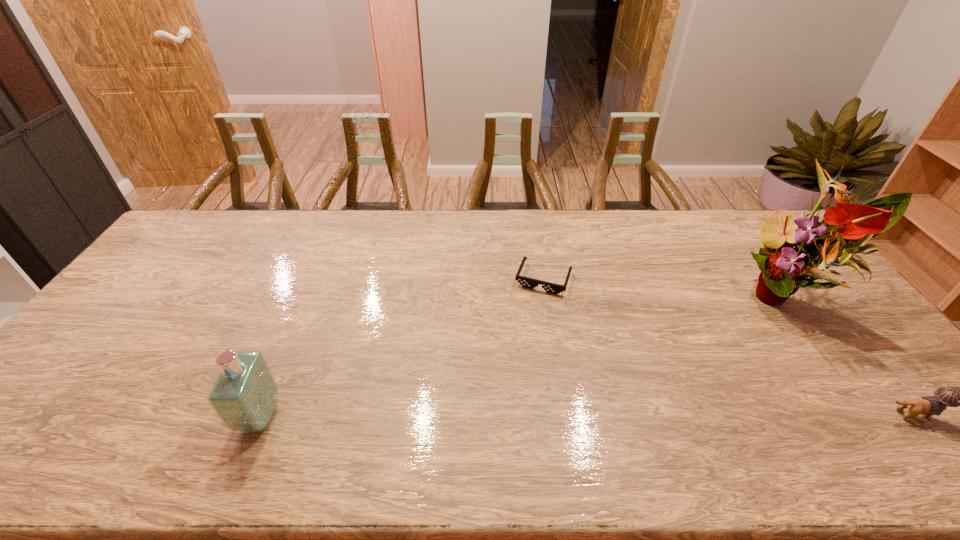
Identify the location of unoccupied area between the tallest object and the kitten. (852, 356).

Choose which object is the nearest neighbor to the perfume. Please provide its 2D coordinates. Your answer should be formatted as a tuple, i.e. [(x, y)], where the tuple contains the x and y coordinates of a point satisfying the conditions above.

[(526, 282)]

Identify which object is the third closest to the kitten. Please provide its 2D coordinates. Your answer should be formatted as a tuple, i.e. [(x, y)], where the tuple contains the x and y coordinates of a point satisfying the conditions above.

[(244, 396)]

At what (x,y) coordinates should I click in order to perform the action: click on free location that satisfies the following two spatial constraints: 1. on the front side of the second object from left to right; 2. on the right side of the bouquet. Please return your answer as a coordinate pair (x, y). Looking at the image, I should click on (546, 297).

Image resolution: width=960 pixels, height=540 pixels. I want to click on vacant space that satisfies the following two spatial constraints: 1. on the front side of the bouquet; 2. on the front-facing side of the kitten, so click(878, 415).

Where is `free spot that satisfies the following two spatial constraints: 1. on the front side of the bouquet; 2. on the right side of the sunglasses`? free spot that satisfies the following two spatial constraints: 1. on the front side of the bouquet; 2. on the right side of the sunglasses is located at coordinates (546, 297).